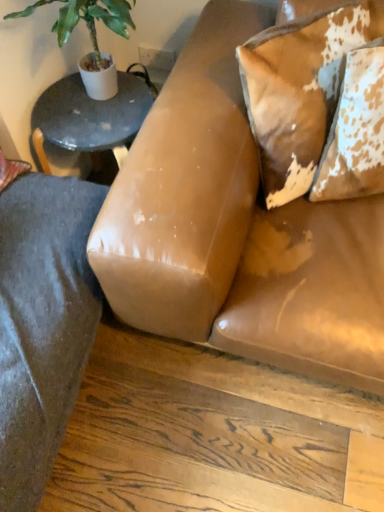
Question: Considering the positions of speckled leather pillow at upper right, the 2th pillow viewed from the right, and brown cowhide pillow at upper right, arranged as the second pillow when viewed from the left, in the image, is speckled leather pillow at upper right, the 2th pillow viewed from the right, wider or thinner than brown cowhide pillow at upper right, arranged as the second pillow when viewed from the left,?

Choices:
 (A) thin
 (B) wide

Answer: (B)

Question: Considering the positions of point (283, 167) and point (360, 104), is point (283, 167) closer or farther from the camera than point (360, 104)?

Choices:
 (A) closer
 (B) farther

Answer: (B)

Question: Based on their relative distances, which object is farther from the speckled leather pillow at upper right, marked as the 1th pillow in a left-to-right arrangement?

Choices:
 (A) leather couch at center
 (B) brown cowhide pillow at upper right, arranged as the second pillow when viewed from the left
 (C) green leafy plant at upper left

Answer: (C)

Question: Which of these objects is positioned farthest from the leather couch at center?

Choices:
 (A) green leafy plant at upper left
 (B) speckled leather pillow at upper right, marked as the 1th pillow in a left-to-right arrangement
 (C) brown cowhide pillow at upper right, placed as the 1th pillow when sorted from right to left

Answer: (A)